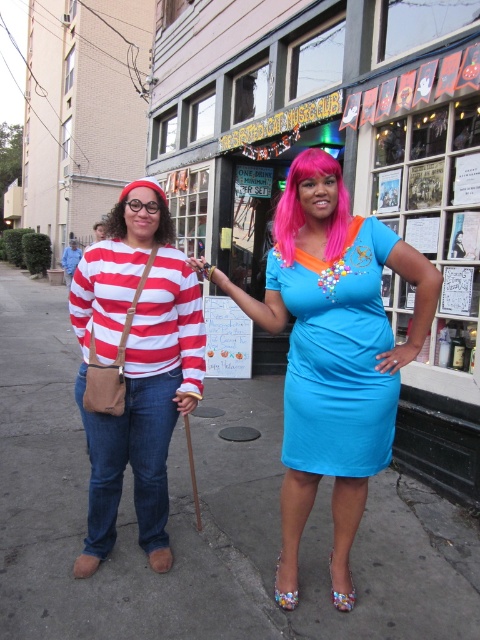
Question: Which of these objects is positioned farthest from the blue satin dress at center?

Choices:
 (A) gray concrete pavement at lower center
 (B) shiny blue dress at center
 (C) dark brown hair at left

Answer: (A)

Question: Does blue satin dress at center appear under pink synthetic wig at center?

Choices:
 (A) no
 (B) yes

Answer: (B)

Question: Which object is positioned farthest from the dark brown hair at left?

Choices:
 (A) shiny blue dress at center
 (B) pink synthetic wig at center

Answer: (B)

Question: Can you confirm if gray concrete pavement at lower center is thinner than blue satin dress at center?

Choices:
 (A) no
 (B) yes

Answer: (A)

Question: Is gray concrete pavement at lower center positioned behind blue satin dress at center?

Choices:
 (A) yes
 (B) no

Answer: (A)

Question: Which of the following is the closest to the observer?

Choices:
 (A) blue satin dress at center
 (B) matte red-white striped shirt at center
 (C) pink synthetic wig at center

Answer: (A)